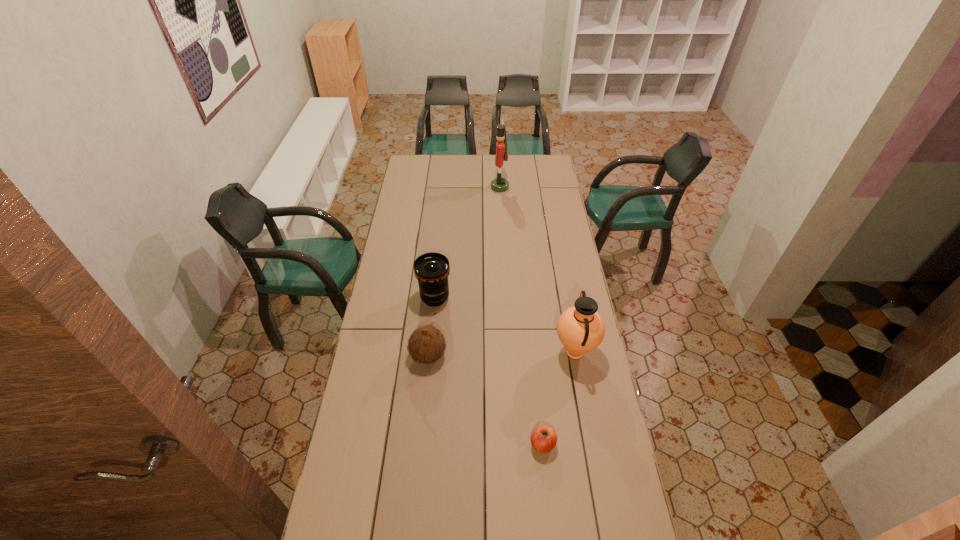
At what (x,y) coordinates should I click in order to perform the action: click on the farthest object. Please return your answer as a coordinate pair (x, y). This screenshot has width=960, height=540. Looking at the image, I should click on (499, 184).

You are a GUI agent. You are given a task and a screenshot of the screen. Output one action in this format:
    pyautogui.click(x=<x>, y=<y>)
    Task: Click on the nutcracker
    The image size is (960, 540).
    Given the screenshot: What is the action you would take?
    pyautogui.click(x=499, y=184)

Locate an element on the screen. the rightmost object is located at coordinates (580, 328).

The image size is (960, 540). I want to click on the fourth shortest object, so click(580, 328).

The width and height of the screenshot is (960, 540). I want to click on coconut, so click(x=426, y=345).

Where is `telephoto lens`? Image resolution: width=960 pixels, height=540 pixels. telephoto lens is located at coordinates (432, 269).

Find the location of a particular element. The image size is (960, 540). the nearest object is located at coordinates (544, 438).

The height and width of the screenshot is (540, 960). I want to click on apple, so click(x=544, y=438).

Locate an element on the screen. free location located 0.220m on the front-facing side of the nutcracker is located at coordinates (453, 187).

Locate an element on the screen. The height and width of the screenshot is (540, 960). free point located on the front-facing side of the nutcracker is located at coordinates (436, 187).